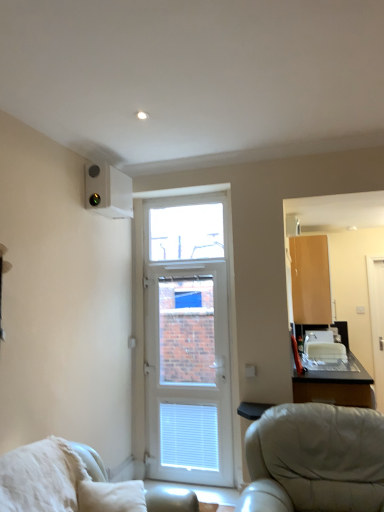
Question: Is white plastic door at center situated inside white fluffy pillow at lower left or outside?

Choices:
 (A) inside
 (B) outside

Answer: (B)

Question: In terms of height, does white plastic door at center look taller or shorter compared to white fluffy pillow at lower left?

Choices:
 (A) tall
 (B) short

Answer: (A)

Question: Based on their relative distances, which object is nearer to the transparent glass window at center?

Choices:
 (A) white fluffy pillow at lower left
 (B) white plastic air conditioning unit at upper left
 (C) white plastic door at center
 (D) matte wood cabinet at upper right
 (E) white glossy screen door at right

Answer: (C)

Question: Based on their relative distances, which object is nearer to the white plastic door at center?

Choices:
 (A) white leather chair at lower left
 (B) transparent glass window at center
 (C) white plastic air conditioning unit at upper left
 (D) white glossy screen door at right
 (E) white fluffy pillow at lower left

Answer: (B)